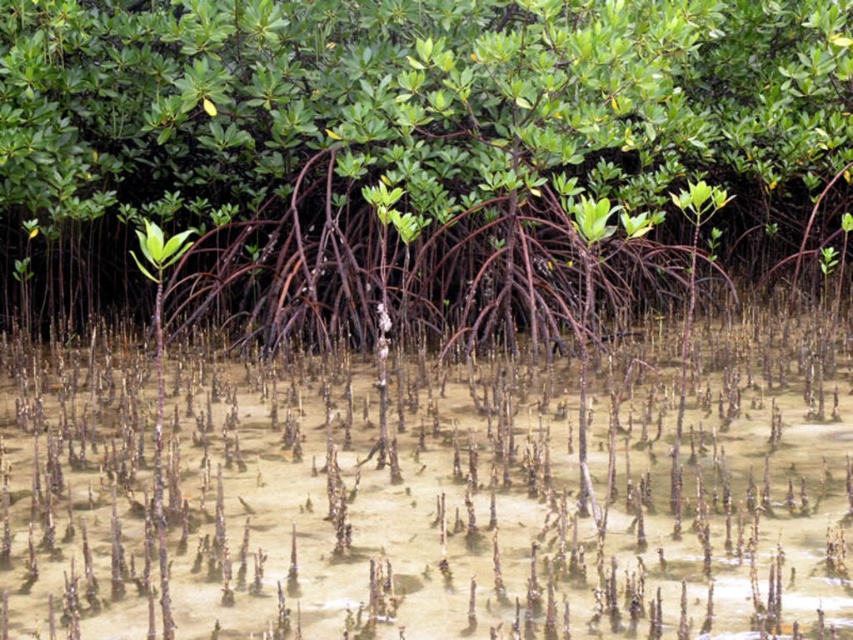
Is green matte tree roots at center wider than translucent sandy water at center?

Indeed, green matte tree roots at center has a greater width compared to translucent sandy water at center.

Is the position of green matte tree roots at center less distant than that of translucent sandy water at center?

No, green matte tree roots at center is behind translucent sandy water at center.

Between point (682, 285) and point (401, 520), which one is positioned behind?

Point (682, 285)

Locate an element on the screen. The width and height of the screenshot is (853, 640). green matte tree roots at center is located at coordinates (413, 154).